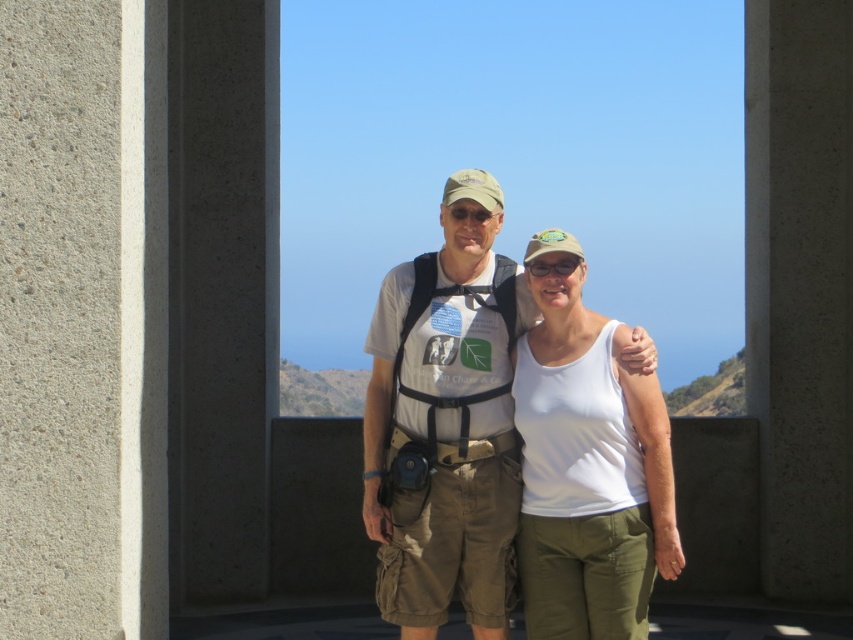
You are a photographer who needs to capture a wide shot of the gray concrete pillar at center and the white cotton tank top at center. Your camera has a maximum focus range of 15 feet. Will you be able to capture both objects in focus at the same time?

The distance between the gray concrete pillar at center and the white cotton tank top at center is 16.36 feet, which exceeds the camera maximum focus range of 15 feet. Therefore, you cannot capture both objects in focus at the same time.